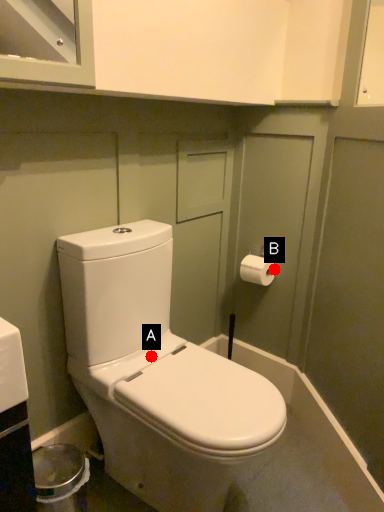
Question: Two points are circled on the image, labeled by A and B beside each circle. Which of the following is the farthest from the observer?

Choices:
 (A) A is further
 (B) B is further

Answer: (B)